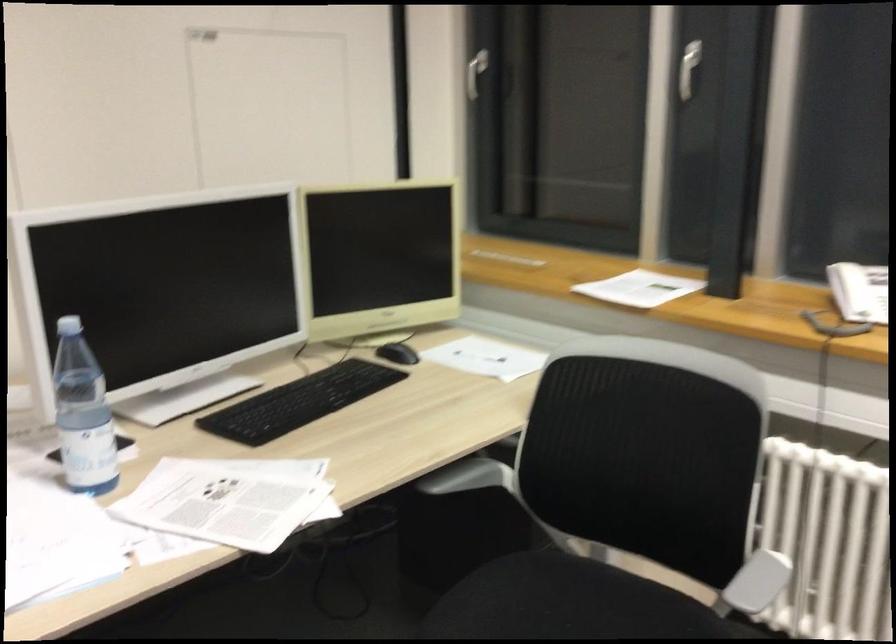
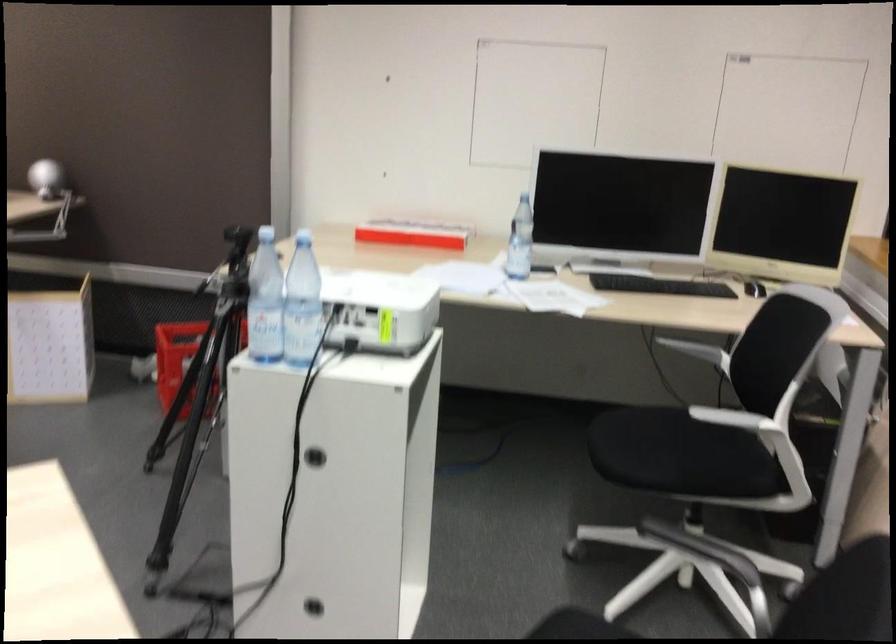
In the second image, find the point that corresponds to point (757, 582) in the first image.

(730, 426)